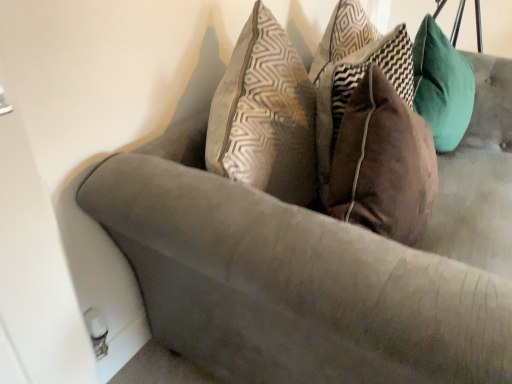
Identify the location of brown suede pillow at upper right. (353, 72).

Describe the element at coordinates (353, 72) in the screenshot. This screenshot has height=384, width=512. I see `brown suede pillow at upper right` at that location.

What is the approximate width of brown suede pillow at upper right?

brown suede pillow at upper right is 8.24 inches wide.

At what (x,y) coordinates should I click in order to perform the action: click on brown suede pillow at upper right. Please return your answer as a coordinate pair (x, y). The height and width of the screenshot is (384, 512). Looking at the image, I should click on (353, 72).